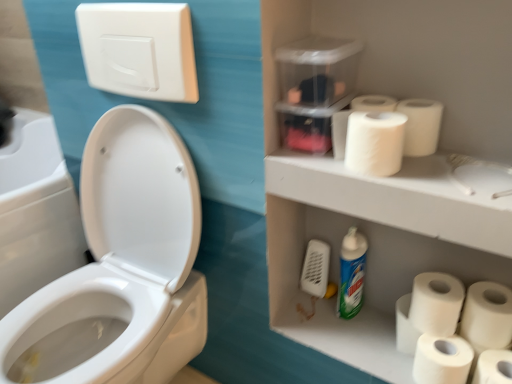
Image resolution: width=512 pixels, height=384 pixels. Find the location of `vacant area that lies in front of white glossy cleaning product at lower center`. vacant area that lies in front of white glossy cleaning product at lower center is located at coordinates (358, 340).